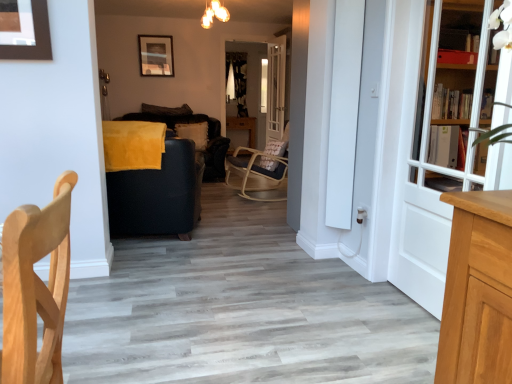
Question: Does white wooden bookcase at right have a smaller size compared to suede-like brown pillow at center, which is counted as the 2th pillow, starting from the bottom?

Choices:
 (A) no
 (B) yes

Answer: (B)

Question: Is white wooden bookcase at right thinner than suede-like brown pillow at center, the first pillow when ordered from top to bottom?

Choices:
 (A) yes
 (B) no

Answer: (A)

Question: Could you tell me if white wooden bookcase at right is turned towards suede-like brown pillow at center, the first pillow when ordered from top to bottom?

Choices:
 (A) no
 (B) yes

Answer: (A)

Question: Would you say white wooden bookcase at right contains suede-like brown pillow at center, which is counted as the 2th pillow, starting from the bottom?

Choices:
 (A) yes
 (B) no

Answer: (B)

Question: Can you confirm if white wooden bookcase at right is taller than suede-like brown pillow at center, which is counted as the 2th pillow, starting from the bottom?

Choices:
 (A) no
 (B) yes

Answer: (B)

Question: Is natural wood chair at left, the 1th chair viewed from the front, taller or shorter than suede-like brown pillow at center, which is counted as the 2th pillow, starting from the bottom?

Choices:
 (A) tall
 (B) short

Answer: (A)

Question: Is point (59, 241) positioned closer to the camera than point (158, 112)?

Choices:
 (A) farther
 (B) closer

Answer: (B)

Question: Is natural wood chair at left, marked as the 2th chair in a back-to-front arrangement, to the left or to the right of suede-like brown pillow at center, which is counted as the 2th pillow, starting from the bottom, in the image?

Choices:
 (A) left
 (B) right

Answer: (B)

Question: Considering the positions of natural wood chair at left, marked as the 2th chair in a back-to-front arrangement, and suede-like brown pillow at center, the first pillow when ordered from top to bottom, in the image, is natural wood chair at left, marked as the 2th chair in a back-to-front arrangement, wider or thinner than suede-like brown pillow at center, the first pillow when ordered from top to bottom,?

Choices:
 (A) wide
 (B) thin

Answer: (A)

Question: Is natural wood chair at left, the 1th chair viewed from the front, taller or shorter than beige textured pillow at center, the second pillow viewed from the top?

Choices:
 (A) short
 (B) tall

Answer: (B)

Question: Would you say natural wood chair at left, marked as the 2th chair in a back-to-front arrangement, is to the left or to the right of beige textured pillow at center, the second pillow viewed from the top, in the picture?

Choices:
 (A) left
 (B) right

Answer: (B)

Question: From the image's perspective, is natural wood chair at left, the 1th chair viewed from the front, located above or below beige textured pillow at center, the second pillow viewed from the top?

Choices:
 (A) above
 (B) below

Answer: (B)

Question: From a real-world perspective, is natural wood chair at left, marked as the 2th chair in a back-to-front arrangement, positioned above or below beige textured pillow at center, the first pillow ordered from the bottom?

Choices:
 (A) below
 (B) above

Answer: (A)

Question: In terms of size, does velvet black armchair at center, the second chair when ordered from front to back, appear bigger or smaller than white wooden bookcase at right?

Choices:
 (A) big
 (B) small

Answer: (A)

Question: Relative to white wooden bookcase at right, is velvet black armchair at center, which is the 1th chair in back-to-front order, in front or behind?

Choices:
 (A) behind
 (B) front

Answer: (A)